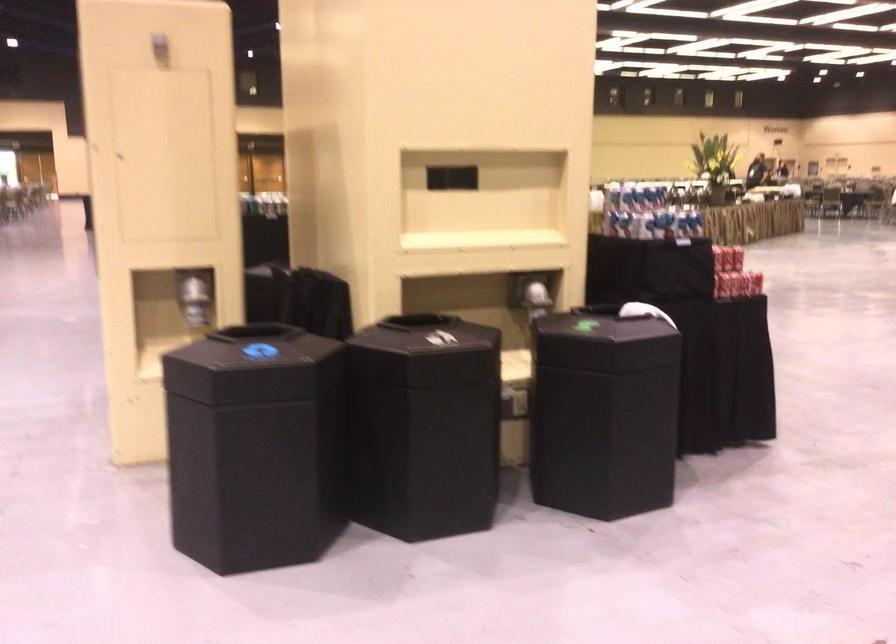
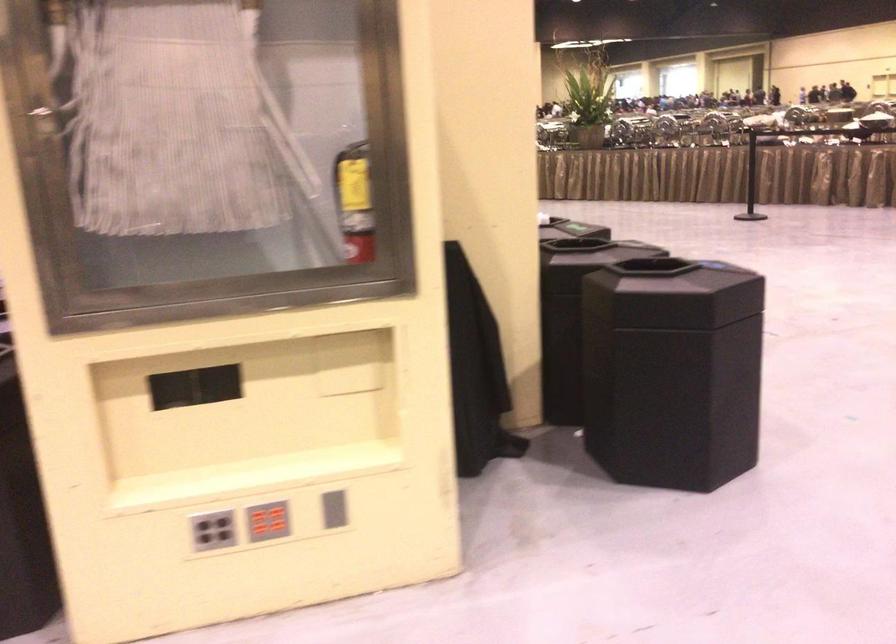
Question: I am providing you with two images of the same scene from different viewpoints. Please identify which objects are invisible in image2.

Choices:
 (A) red button panel
 (B) black trash can lid
 (C) yellow handle scissors
 (D) shiny dispenser lever

Answer: (D)